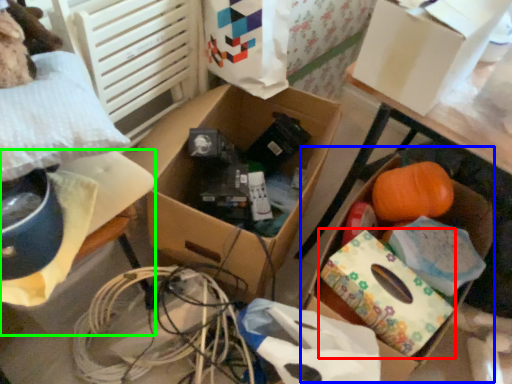
Question: Which object is positioned closest to cardboard box (highlighted by a red box)? Select from storage box (highlighted by a blue box) and storage box (highlighted by a green box).

Choices:
 (A) storage box
 (B) storage box

Answer: (A)